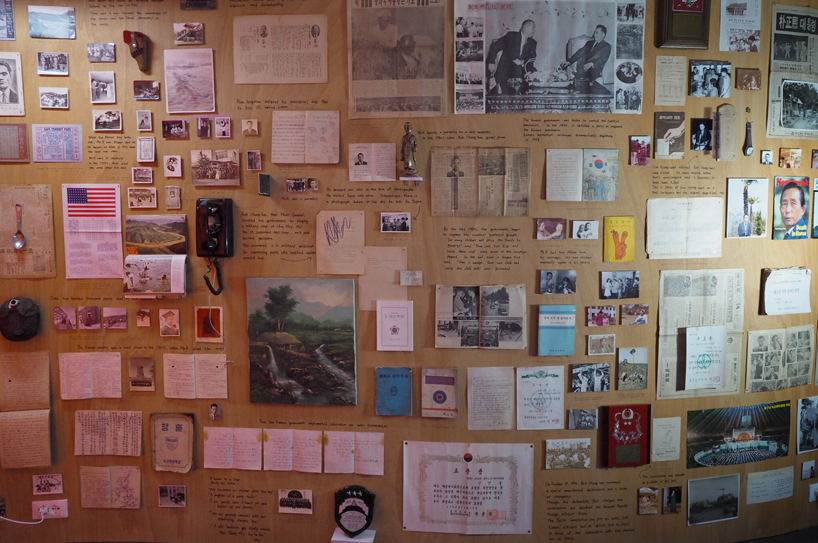
The image size is (818, 543). What are the coordinates of `phone` in the screenshot? It's located at (198, 203).